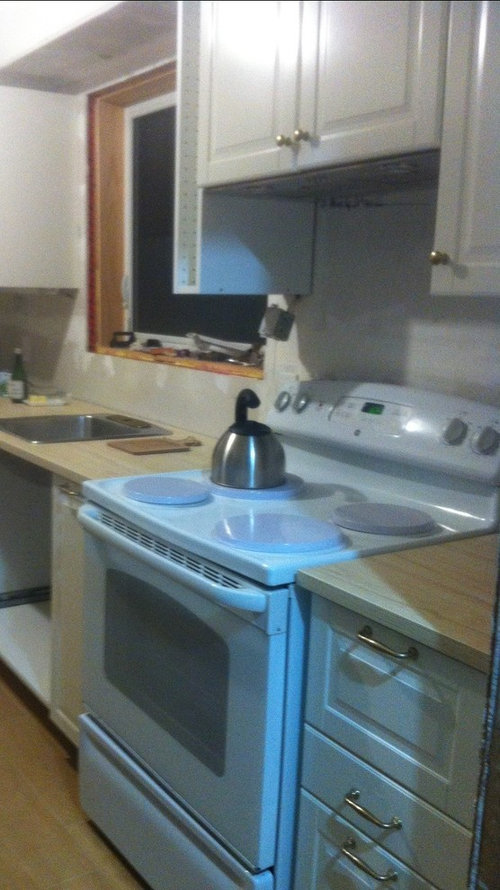
Where is `space for missing rangehood over stove`? This screenshot has height=890, width=500. space for missing rangehood over stove is located at coordinates (336, 213).